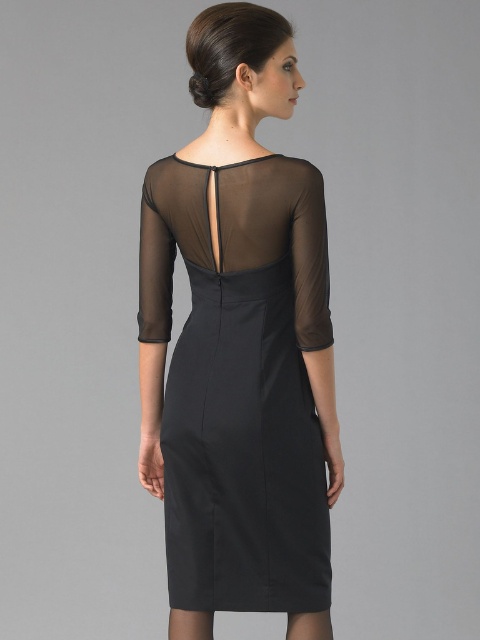
Consider the image. You are standing at point (240, 205) and want to move 1.63 meters forward in a straight line. Will you exit the image area?

Yes, moving 1.63 meters forward from point (240, 205) will take you beyond the image boundaries, so you will exit the image area.